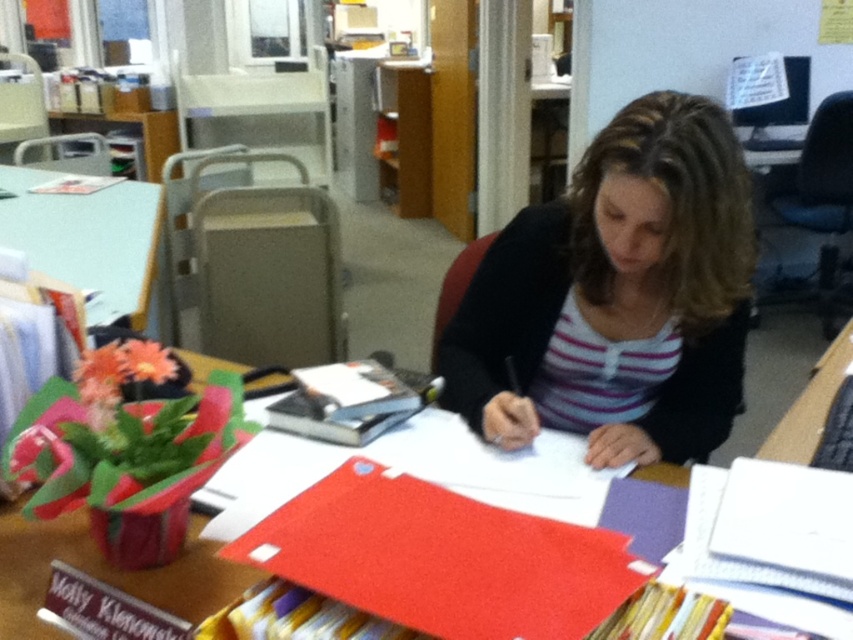
You are a delivery person who needs to place a package on the desk without disturbing the striped knit sweater at center. The package is 3 feet long. Can you place it horizontally on the desk?

The package is 3 feet long, and the distance between the striped knit sweater at center and the edge of the desk is 3.47 feet. Since 3 feet is less than 3.47 feet, the package can be placed horizontally without disturbing the striped knit sweater at center.

You are organizing the desk items and need to place a new item between the striped knit sweater at center and the white paper at center. Where should you position it?

You should place the new item between the striped knit sweater at center and the white paper at center to the right of the sweater and to the left of the paper since the sweater is to the left of the paper.

You are standing in front of the desk in the office scene. There are two points marked on the desk surface. Which point is closer to you, point (122, 582) or point (419, 410)?

Point (122, 582) is closer to the viewer than point (419, 410).